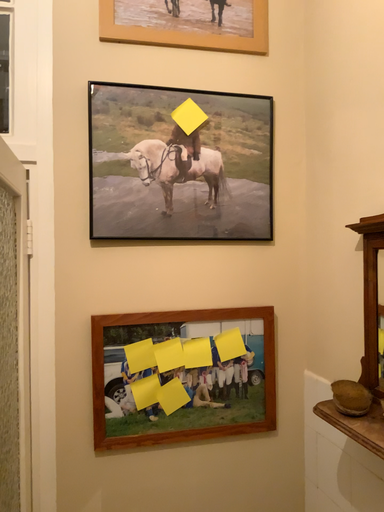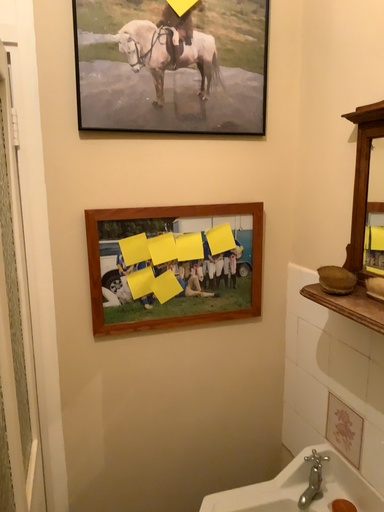
Question: Which way did the camera rotate in the video?

Choices:
 (A) rotated upward
 (B) rotated downward

Answer: (B)